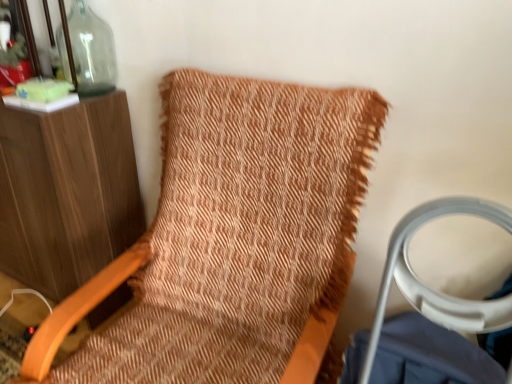
Question: Does transparent glass bottle at upper left have a smaller size compared to textured orange fabric bean bag chair at center?

Choices:
 (A) yes
 (B) no

Answer: (A)

Question: Is transparent glass bottle at upper left oriented towards textured orange fabric bean bag chair at center?

Choices:
 (A) no
 (B) yes

Answer: (A)

Question: From a real-world perspective, is transparent glass bottle at upper left positioned over textured orange fabric bean bag chair at center based on gravity?

Choices:
 (A) yes
 (B) no

Answer: (A)

Question: From the image's perspective, does transparent glass bottle at upper left appear higher than textured orange fabric bean bag chair at center?

Choices:
 (A) no
 (B) yes

Answer: (B)

Question: Is transparent glass bottle at upper left shorter than textured orange fabric bean bag chair at center?

Choices:
 (A) yes
 (B) no

Answer: (A)

Question: Considering the relative sizes of transparent glass bottle at upper left and textured orange fabric bean bag chair at center in the image provided, is transparent glass bottle at upper left thinner than textured orange fabric bean bag chair at center?

Choices:
 (A) yes
 (B) no

Answer: (A)

Question: From a real-world perspective, is textured orange fabric bean bag chair at center on transparent glass bottle at upper left?

Choices:
 (A) no
 (B) yes

Answer: (A)

Question: Are textured orange fabric bean bag chair at center and transparent glass bottle at upper left making contact?

Choices:
 (A) yes
 (B) no

Answer: (B)

Question: Does textured orange fabric bean bag chair at center have a larger size compared to transparent glass bottle at upper left?

Choices:
 (A) no
 (B) yes

Answer: (B)

Question: Is textured orange fabric bean bag chair at center not near transparent glass bottle at upper left?

Choices:
 (A) yes
 (B) no

Answer: (B)

Question: Can you confirm if textured orange fabric bean bag chair at center is positioned to the left of transparent glass bottle at upper left?

Choices:
 (A) no
 (B) yes

Answer: (A)

Question: Is transparent glass bottle at upper left completely or partially inside textured orange fabric bean bag chair at center?

Choices:
 (A) yes
 (B) no

Answer: (B)

Question: In terms of width, does textured orange fabric bean bag chair at center look wider or thinner when compared to transparent glass bottle at upper left?

Choices:
 (A) thin
 (B) wide

Answer: (B)